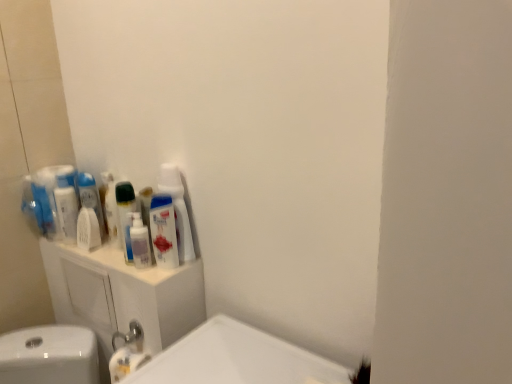
Locate an element on the screen. free point above white plastic cabinet at upper left (from a real-world perspective) is located at coordinates tap(106, 254).